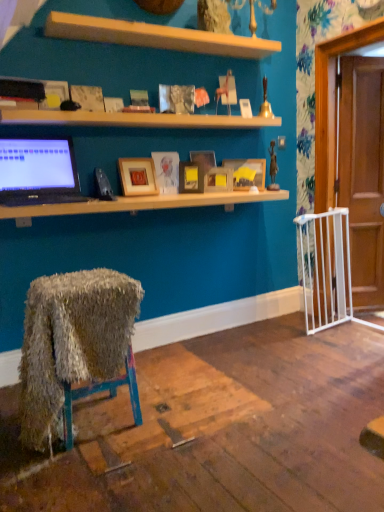
Question: Does matte wooden picture frame at center, the fourth picture frame positioned from the left, have a smaller size compared to matte wooden picture frame at center, which is the second picture frame from left to right?

Choices:
 (A) yes
 (B) no

Answer: (B)

Question: Considering the relative sizes of matte wooden picture frame at center, the fourth picture frame positioned from the left, and matte wooden picture frame at center, which is the second picture frame from left to right, in the image provided, is matte wooden picture frame at center, the fourth picture frame positioned from the left, shorter than matte wooden picture frame at center, which is the second picture frame from left to right,?

Choices:
 (A) no
 (B) yes

Answer: (A)

Question: From the image's perspective, is matte wooden picture frame at center, the fourth picture frame positioned from the left, above matte wooden picture frame at center, which appears as the fifth picture frame when viewed from the right?

Choices:
 (A) yes
 (B) no

Answer: (A)

Question: Considering the relative sizes of matte wooden picture frame at center, the fourth picture frame positioned from the left, and matte wooden picture frame at center, which is the second picture frame from left to right, in the image provided, is matte wooden picture frame at center, the fourth picture frame positioned from the left, wider than matte wooden picture frame at center, which is the second picture frame from left to right,?

Choices:
 (A) no
 (B) yes

Answer: (B)

Question: Is matte wooden picture frame at center, the third picture frame in the right-to-left sequence, bigger than matte wooden picture frame at center, which is the second picture frame from left to right?

Choices:
 (A) yes
 (B) no

Answer: (A)

Question: Relative to wooden shelf at upper center, which appears as the second shelf when viewed from the top, is fuzzy fabric chair at lower left, which is the 2th desk in top-to-bottom order, in front or behind?

Choices:
 (A) behind
 (B) front

Answer: (B)

Question: From a real-world perspective, is fuzzy fabric chair at lower left, which is the 2th desk in top-to-bottom order, above or below wooden shelf at upper center, which is counted as the first shelf, starting from the bottom?

Choices:
 (A) below
 (B) above

Answer: (A)

Question: Is point (48, 300) closer or farther from the camera than point (230, 123)?

Choices:
 (A) farther
 (B) closer

Answer: (B)

Question: Is fuzzy fabric chair at lower left, which is counted as the 1th desk, starting from the bottom, to the left or to the right of wooden shelf at upper center, which is counted as the first shelf, starting from the bottom, in the image?

Choices:
 (A) left
 (B) right

Answer: (A)

Question: Is wooden shelf at upper center, which appears as the second shelf when viewed from the top, in front of or behind matte wooden picture frame at center, which is the second picture frame from left to right, in the image?

Choices:
 (A) behind
 (B) front

Answer: (B)

Question: From the image's perspective, is wooden shelf at upper center, which is counted as the first shelf, starting from the bottom, positioned above or below matte wooden picture frame at center, which appears as the fifth picture frame when viewed from the right?

Choices:
 (A) below
 (B) above

Answer: (B)

Question: Considering the positions of point (261, 122) and point (168, 179), is point (261, 122) closer or farther from the camera than point (168, 179)?

Choices:
 (A) farther
 (B) closer

Answer: (A)

Question: In terms of width, does wooden shelf at upper center, which appears as the second shelf when viewed from the top, look wider or thinner when compared to matte wooden picture frame at center, which appears as the fifth picture frame when viewed from the right?

Choices:
 (A) wide
 (B) thin

Answer: (A)

Question: From the image's perspective, is matte wooden picture frame at center, the sixth picture frame when ordered from left to right, positioned above or below matte gold picture frame at center, acting as the 4th picture frame starting from the right?

Choices:
 (A) below
 (B) above

Answer: (B)

Question: From a real-world perspective, is matte wooden picture frame at center, the sixth picture frame when ordered from left to right, positioned above or below matte gold picture frame at center, the 3th picture frame when ordered from left to right?

Choices:
 (A) below
 (B) above

Answer: (B)